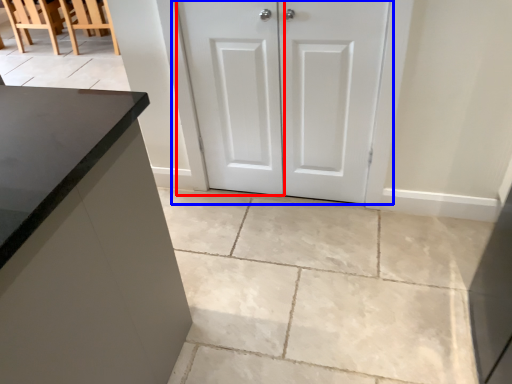
Question: Which point is further to the camera, screen door (highlighted by a red box) or door (highlighted by a blue box)?

Choices:
 (A) screen door
 (B) door

Answer: (A)